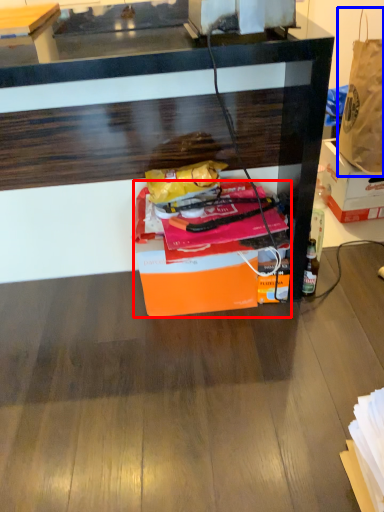
Question: Which object is further to the camera taking this photo, box (highlighted by a red box) or handbag (highlighted by a blue box)?

Choices:
 (A) box
 (B) handbag

Answer: (B)